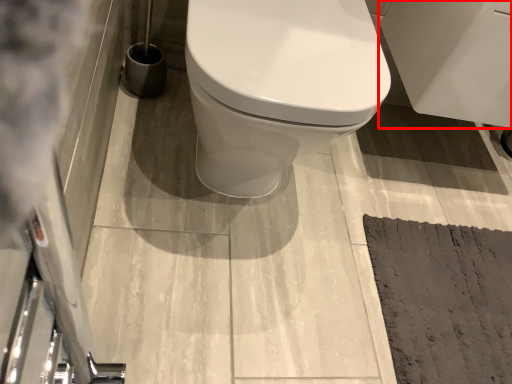
Question: From the image's perspective, where is porcelain (annotated by the red box) located relative to doormat?

Choices:
 (A) above
 (B) below

Answer: (A)